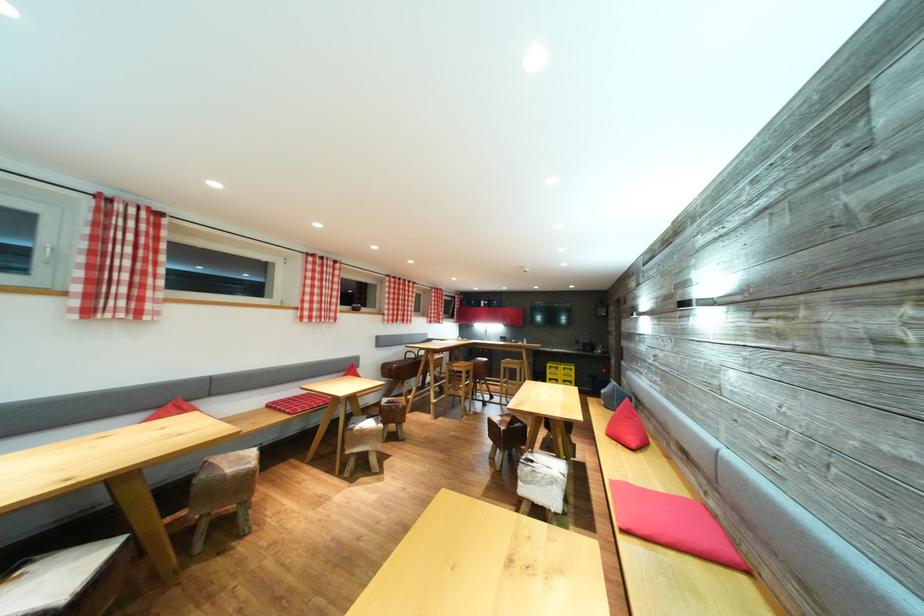
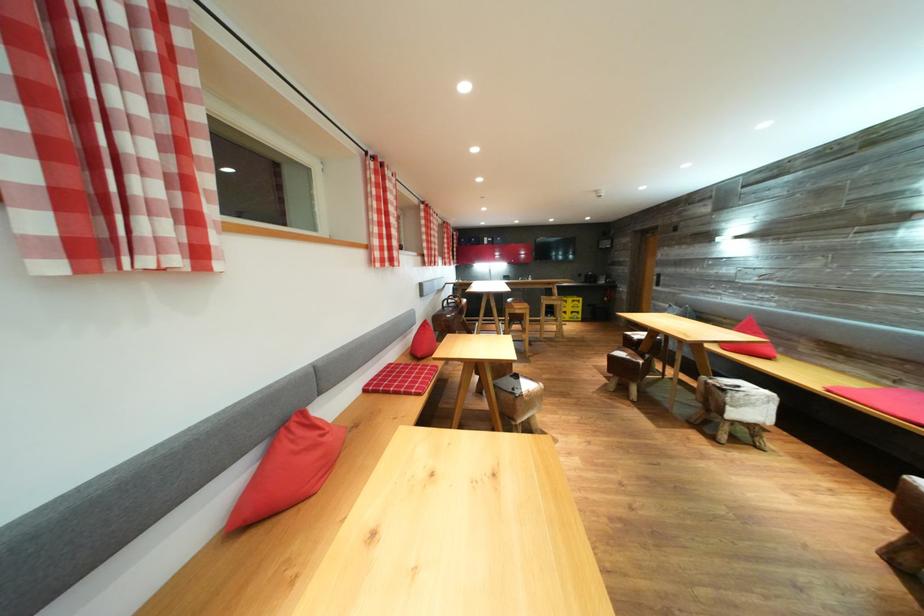
Find the pixel in the second image that matches [540,467] in the first image.

(745, 392)